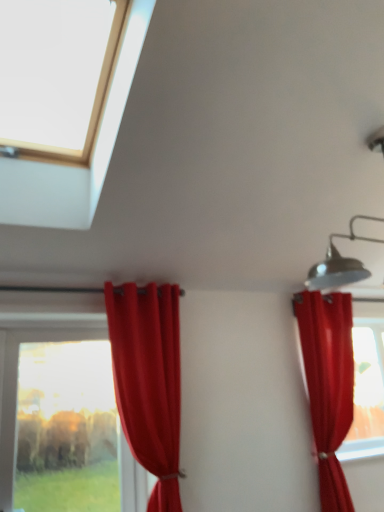
Question: Would you say transparent glass window at upper left, arranged as the 1th window when viewed from the front, is to the left or to the right of velvet red curtain at left, which appears as the 2th curtain when viewed from the right, in the picture?

Choices:
 (A) right
 (B) left

Answer: (B)

Question: Considering the positions of transparent glass window at upper left, the 2th window when ordered from bottom to top, and velvet red curtain at left, acting as the 1th curtain starting from the left, in the image, is transparent glass window at upper left, the 2th window when ordered from bottom to top, taller or shorter than velvet red curtain at left, acting as the 1th curtain starting from the left,?

Choices:
 (A) tall
 (B) short

Answer: (B)

Question: Which object is positioned farthest from the satin red curtain at right, which appears as the first curtain when viewed from the right?

Choices:
 (A) transparent glass window at upper left, which is the 2th window from back to front
 (B) transparent glass window at lower left, placed as the first window when sorted from back to front
 (C) velvet red curtain at left, acting as the 1th curtain starting from the left

Answer: (B)

Question: Estimate the real-world distances between objects in this image. Which object is farther from the transparent glass window at lower left, placed as the first window when sorted from back to front?

Choices:
 (A) transparent glass window at upper left, the 2th window when ordered from bottom to top
 (B) satin red curtain at right, the second curtain when ordered from left to right
 (C) velvet red curtain at left, which appears as the 2th curtain when viewed from the right

Answer: (A)